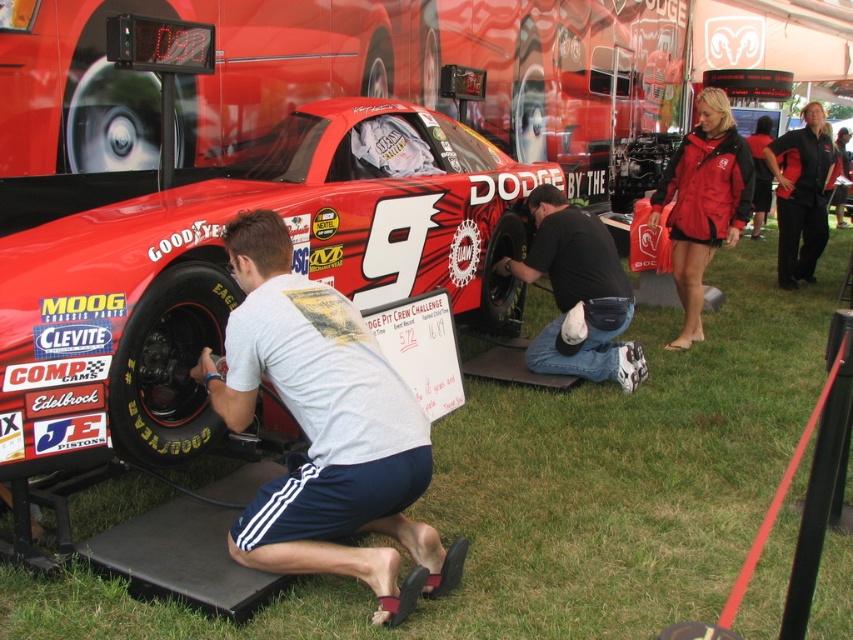
You are a spectator at the car event and want to take a photo of both the shiny red car at center and the red matte jacket at upper right. Which object should you frame first in your camera viewfinder to ensure both are in the shot?

The shiny red car at center is to the left of the red matte jacket at upper right, so you should frame the shiny red car at center first on the left side of the viewfinder to include both objects in the shot.